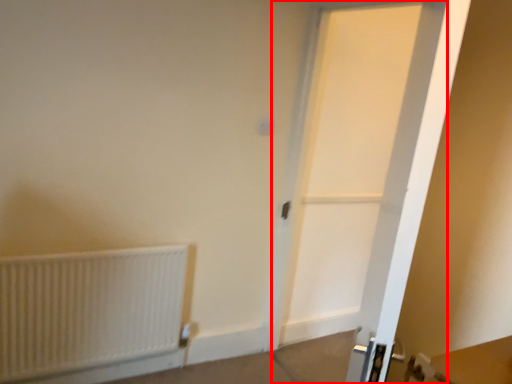
Question: From the image, what is the correct spatial relationship of door (annotated by the red box) in relation to radiator?

Choices:
 (A) right
 (B) left

Answer: (A)